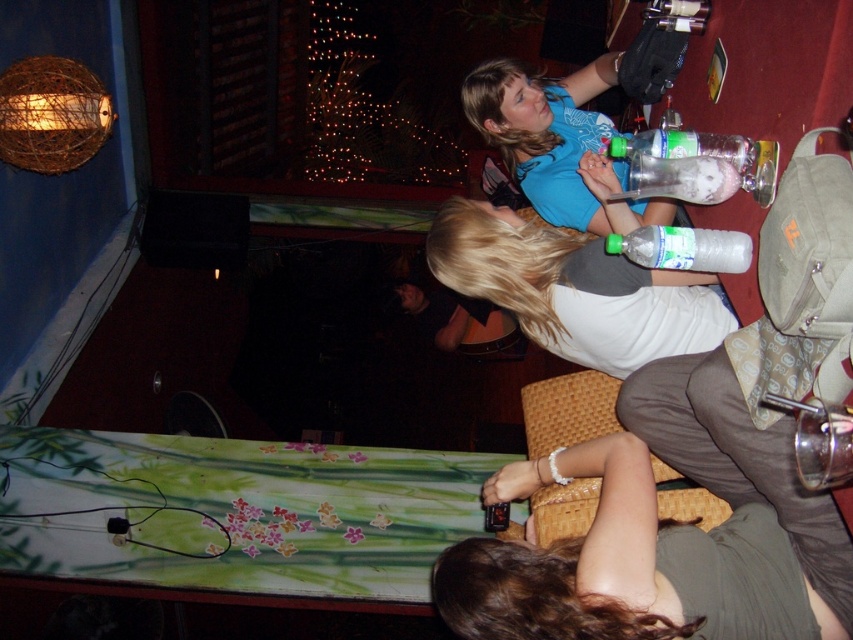
Consider the image. Between gray fabric shirt at upper center and translucent plastic bottle at upper center, which one has less height?

translucent plastic bottle at upper center

Is point (561, 320) positioned before point (695, 145)?

No.

The width and height of the screenshot is (853, 640). I want to click on gray fabric shirt at upper center, so click(x=573, y=291).

Is point (517, 280) positioned behind point (608, 410)?

That is False.

Does gray fabric shirt at upper center have a greater width compared to woven brown chair at lower center?

Yes, gray fabric shirt at upper center is wider than woven brown chair at lower center.

Between point (544, 273) and point (550, 502), which one is positioned in front?

Point (544, 273)

You are a GUI agent. You are given a task and a screenshot of the screen. Output one action in this format:
    pyautogui.click(x=<x>, y=<y>)
    Task: Click on the gray fabric shirt at upper center
    
    Given the screenshot: What is the action you would take?
    pyautogui.click(x=573, y=291)

Is green plastic bottle at center above translucent plastic bottle at upper right?

Incorrect, green plastic bottle at center is not positioned above translucent plastic bottle at upper right.

Does green plastic bottle at center appear under translucent plastic bottle at upper right?

Indeed, green plastic bottle at center is positioned under translucent plastic bottle at upper right.

Which is in front, point (726, 257) or point (682, 196)?

Point (726, 257)

Where is `green plastic bottle at center`? This screenshot has height=640, width=853. green plastic bottle at center is located at coordinates (683, 248).